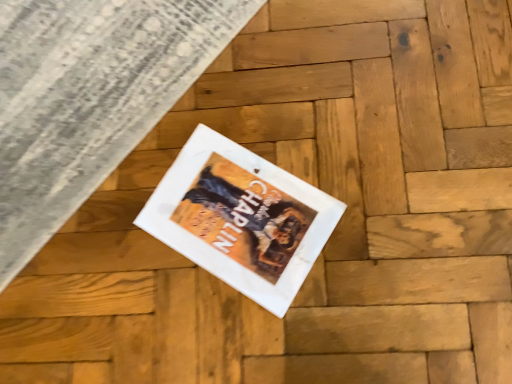
The width and height of the screenshot is (512, 384). What do you see at coordinates (241, 218) in the screenshot?
I see `white matte picture frame at center` at bounding box center [241, 218].

Where is `white matte picture frame at center`? white matte picture frame at center is located at coordinates (241, 218).

Find the location of a particular element. The height and width of the screenshot is (384, 512). white matte picture frame at center is located at coordinates (241, 218).